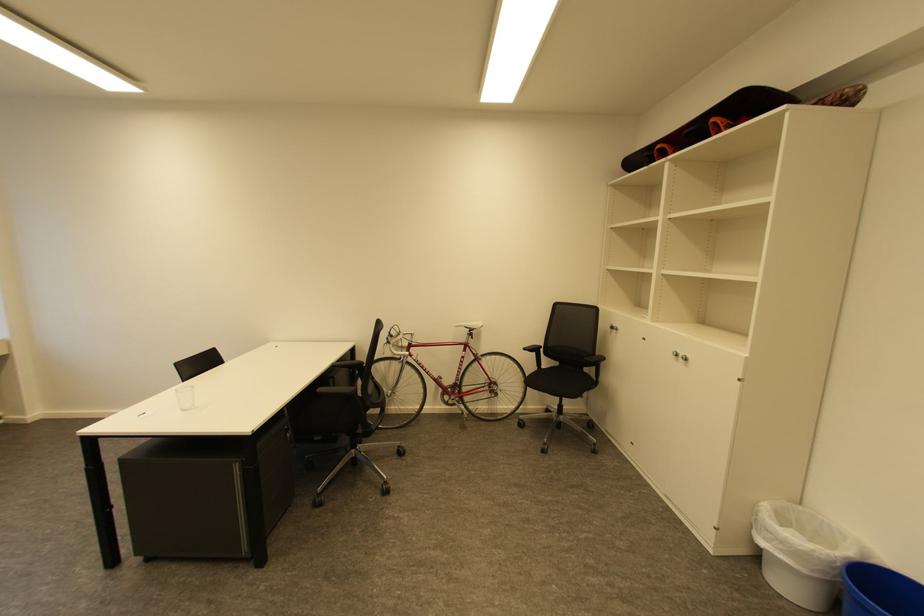
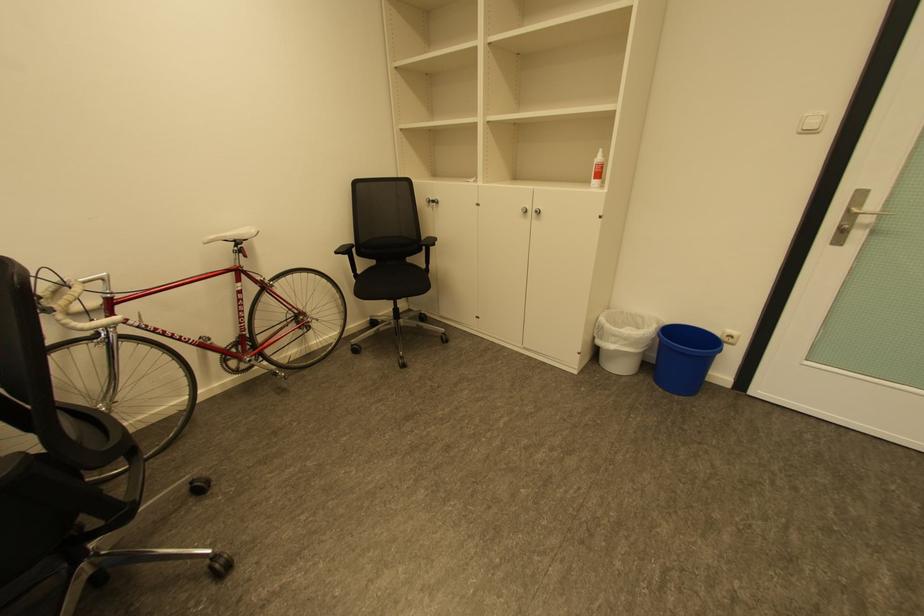
Locate, in the second image, the point that corresponds to point 564,363 in the first image.

(380, 262)